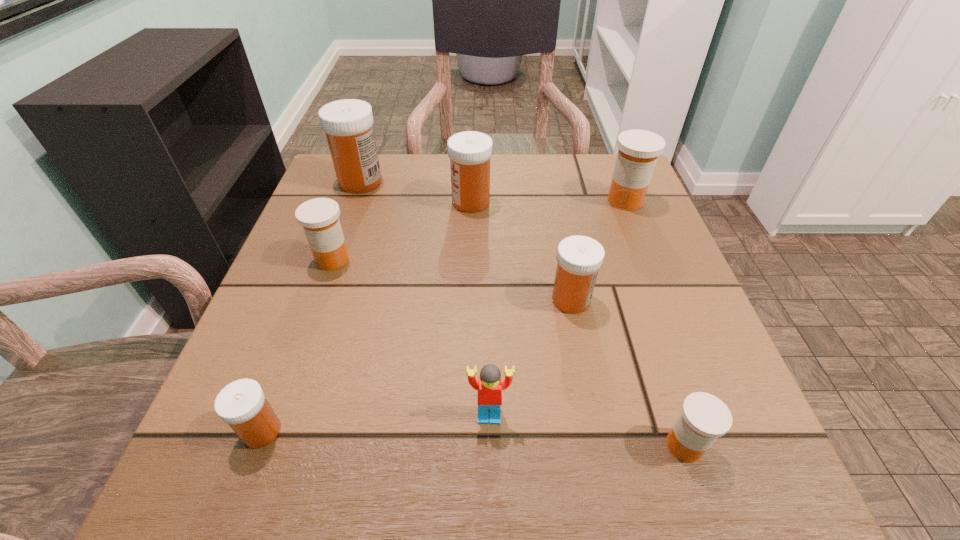
Identify the location of blank space located 0.360m on the label of the nearest orange medicine. Image resolution: width=960 pixels, height=540 pixels. (401, 445).

At what (x,y) coordinates should I click in order to perform the action: click on vacant space situated on the back of the smallest white medicine. Please return your answer as a coordinate pair (x, y). Looking at the image, I should click on (290, 355).

At what (x,y) coordinates should I click in order to perform the action: click on object that is at the far left corner. Please return your answer as a coordinate pair (x, y). The width and height of the screenshot is (960, 540). Looking at the image, I should click on (348, 124).

Where is `object that is positioned at the near left corner`? The height and width of the screenshot is (540, 960). object that is positioned at the near left corner is located at coordinates (242, 404).

Find the location of `object that is at the far right corner`. object that is at the far right corner is located at coordinates pyautogui.click(x=638, y=151).

The height and width of the screenshot is (540, 960). What are the coordinates of `object that is at the near right corner` in the screenshot? It's located at (704, 417).

Identify the location of free space at the far edge. Image resolution: width=960 pixels, height=540 pixels. (522, 183).

Where is `free space at the near edge`? The height and width of the screenshot is (540, 960). free space at the near edge is located at coordinates (518, 468).

In the image, there is a desktop. In order to click on vacant space at the left edge in this screenshot , I will do `click(264, 378)`.

Locate an element on the screen. The width and height of the screenshot is (960, 540). blank space at the right edge of the desktop is located at coordinates (658, 227).